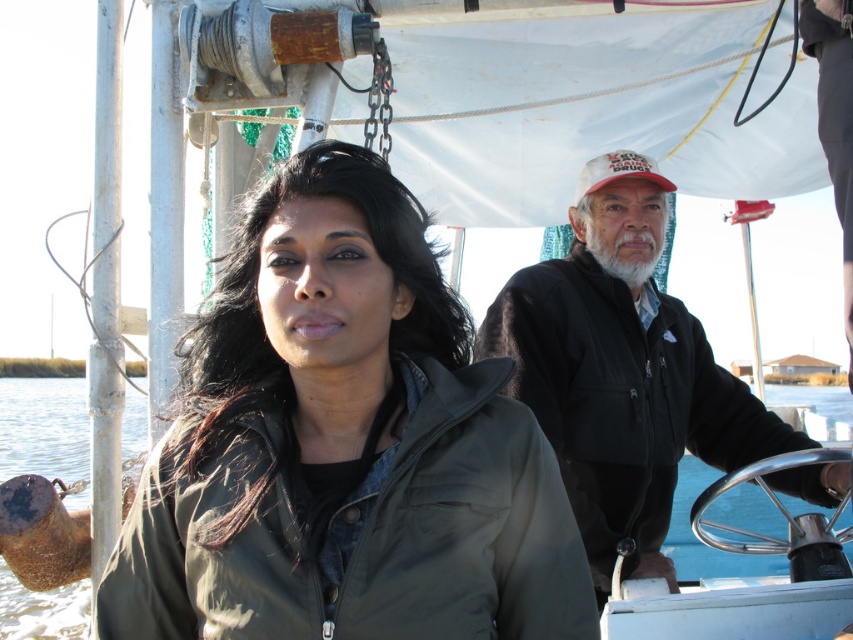
You are on a boat and need to retrieve an item that fell into the water. The item is floating near the clear blue water at center. Can you reach it without moving past the black fleece jacket at center?

The black fleece jacket at center is in front of the clear blue water at center, so you cannot reach the floating item without moving past the jacket.

You are on a boat with two people. You see a point at coordinates (344, 445). Which object is located at that point?

The point at coordinates (344, 445) marks the green matte jacket at center.

You are on a boat and need to hand a tool to the person wearing the green matte jacket at center and the black fleece jacket at center. Which jacket should you reach for first if you want to give the tool to the closer person?

The green matte jacket at center is closer to the viewer than the black fleece jacket at center, so you should reach for the green matte jacket at center first.